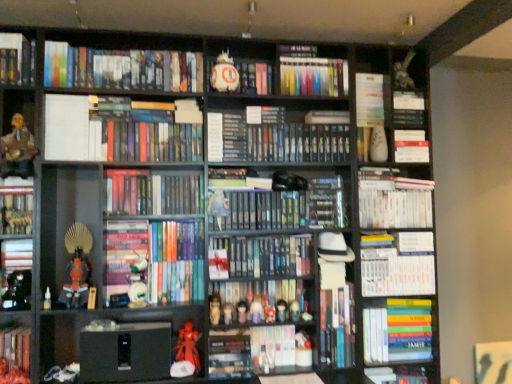
Question: Is shiny black figurine at left, placed as the 12th toy when sorted from right to left, smaller than matte plastic figurine at center, the sixth toy positioned from the right?

Choices:
 (A) no
 (B) yes

Answer: (A)

Question: Is shiny black figurine at left, placed as the 12th toy when sorted from right to left, next to matte plastic figurine at center, which is counted as the 7th toy, starting from the left?

Choices:
 (A) yes
 (B) no

Answer: (B)

Question: From a real-world perspective, is shiny black figurine at left, positioned as the first toy in left-to-right order, on matte plastic figurine at center, the sixth toy positioned from the right?

Choices:
 (A) no
 (B) yes

Answer: (A)

Question: Is shiny black figurine at left, positioned as the first toy in left-to-right order, in front of matte plastic figurine at center, which is counted as the 7th toy, starting from the left?

Choices:
 (A) yes
 (B) no

Answer: (A)

Question: Considering the relative sizes of shiny black figurine at left, positioned as the first toy in left-to-right order, and matte plastic figurine at center, which is counted as the 7th toy, starting from the left, in the image provided, is shiny black figurine at left, positioned as the first toy in left-to-right order, bigger than matte plastic figurine at center, which is counted as the 7th toy, starting from the left,?

Choices:
 (A) yes
 (B) no

Answer: (A)

Question: Does shiny black figurine at left, positioned as the first toy in left-to-right order, have a lesser height compared to matte plastic figurine at center, which is counted as the 7th toy, starting from the left?

Choices:
 (A) yes
 (B) no

Answer: (A)

Question: Considering the relative positions of white matte bb-8 droid at upper center, marked as the 23th book in a bottom-to-top arrangement, and white paper at upper left in the image provided, is white matte bb-8 droid at upper center, marked as the 23th book in a bottom-to-top arrangement, in front of white paper at upper left?

Choices:
 (A) no
 (B) yes

Answer: (A)

Question: Is white matte bb-8 droid at upper center, marked as the 23th book in a bottom-to-top arrangement, oriented towards white paper at upper left?

Choices:
 (A) yes
 (B) no

Answer: (B)

Question: Is white paper at upper left a part of white matte bb-8 droid at upper center, marked as the 23th book in a bottom-to-top arrangement?

Choices:
 (A) yes
 (B) no

Answer: (B)

Question: Is white matte bb-8 droid at upper center, the 1th book in the top-to-bottom sequence, bigger than white paper at upper left?

Choices:
 (A) no
 (B) yes

Answer: (B)

Question: Considering the relative sizes of white matte bb-8 droid at upper center, marked as the 23th book in a bottom-to-top arrangement, and white paper at upper left in the image provided, is white matte bb-8 droid at upper center, marked as the 23th book in a bottom-to-top arrangement, thinner than white paper at upper left?

Choices:
 (A) no
 (B) yes

Answer: (A)

Question: Is white matte bb-8 droid at upper center, marked as the 23th book in a bottom-to-top arrangement, located outside white paper at upper left?

Choices:
 (A) no
 (B) yes

Answer: (B)

Question: Is hardcover books at upper left, which appears as the 21th book when ordered from the bottom, oriented away from hardcover book at center, the 21th book positioned from the top?

Choices:
 (A) no
 (B) yes

Answer: (A)